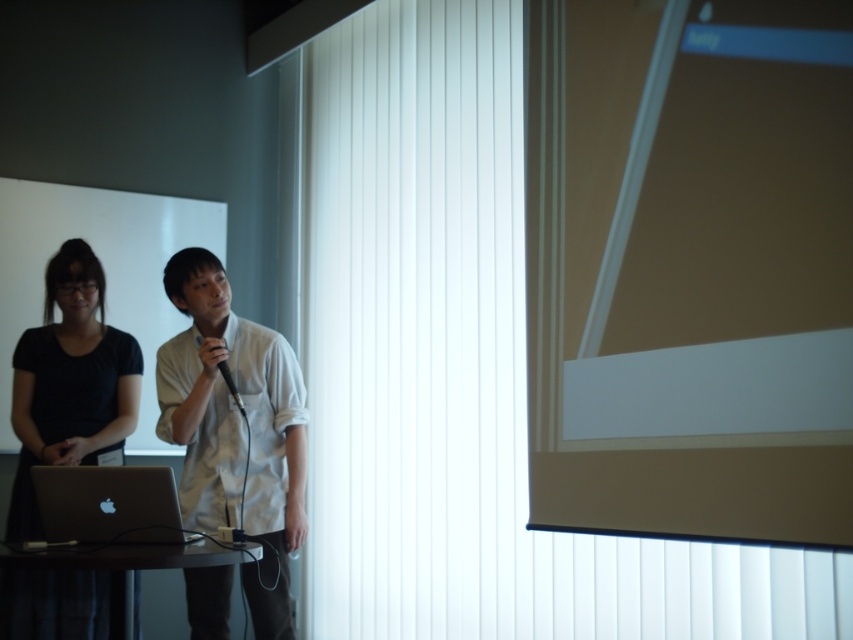
Question: Which of the following is the closest to the observer?

Choices:
 (A) dark wood table at lower left
 (B) black matte microphone at center
 (C) silver metallic laptop at lower left

Answer: (A)

Question: Is white vertical blinds at center above silver metallic laptop at lower left?

Choices:
 (A) no
 (B) yes

Answer: (B)

Question: Is white vertical blinds at center smaller than dark wood table at lower left?

Choices:
 (A) yes
 (B) no

Answer: (B)

Question: Considering the real-world distances, which object is closest to the black matte laptop at lower left?

Choices:
 (A) white matte shirt at center
 (B) white vertical blinds at center

Answer: (A)

Question: Which of the following is the farthest from the observer?

Choices:
 (A) white matte shirt at center
 (B) black matte laptop at lower left

Answer: (B)

Question: Can you confirm if black matte laptop at lower left is positioned to the right of black matte microphone at center?

Choices:
 (A) no
 (B) yes

Answer: (A)